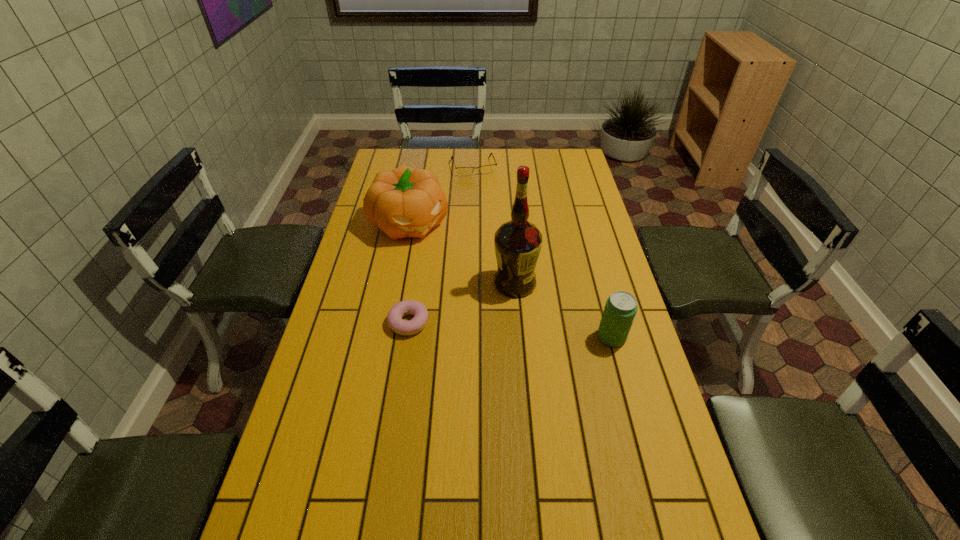
Locate an element on the screen. object that is at the left edge is located at coordinates (405, 202).

Find the location of a particular element. This screenshot has width=960, height=540. object that is at the right edge is located at coordinates (619, 312).

Locate an element on the screen. The width and height of the screenshot is (960, 540). vacant point at the far edge is located at coordinates (528, 151).

Identify the location of free point at the near edge. Image resolution: width=960 pixels, height=540 pixels. (372, 502).

This screenshot has height=540, width=960. Find the location of `blank area at the left edge`. blank area at the left edge is located at coordinates (374, 240).

I want to click on vacant space at the right edge, so click(x=632, y=394).

Locate an element on the screen. vacant space at the near right corner of the desktop is located at coordinates (681, 515).

I want to click on free space between the alcohol and the third tallest object, so click(564, 310).

Where is `free point between the doughnut and the third tallest object`? This screenshot has width=960, height=540. free point between the doughnut and the third tallest object is located at coordinates (510, 330).

You are a GUI agent. You are given a task and a screenshot of the screen. Output one action in this format:
    pyautogui.click(x=<x>, y=<y>)
    Task: Click on the free point between the second farthest object and the tallest object
    The height and width of the screenshot is (540, 960).
    Given the screenshot: What is the action you would take?
    pyautogui.click(x=463, y=253)